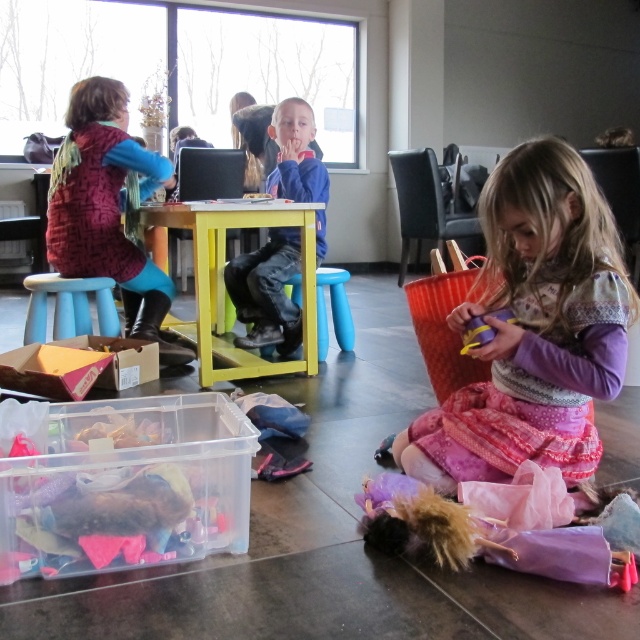
Does pink fabric dress at lower right lie behind blue fleece jacket at center?

No.

Is pink fabric dress at lower right taller than blue fleece jacket at center?

In fact, pink fabric dress at lower right may be shorter than blue fleece jacket at center.

Find the location of `pink fabric dress at lower right`. pink fabric dress at lower right is located at coordinates (534, 330).

Which is below, yellow painted wood table at center or blue fleece jacket at center?

yellow painted wood table at center is below.

Does yellow painted wood table at center have a lesser width compared to blue fleece jacket at center?

No.

Between point (314, 332) and point (288, 332), which one is positioned in front?

Positioned in front is point (314, 332).

Where is `yellow painted wood table at center`? This screenshot has height=640, width=640. yellow painted wood table at center is located at coordinates (224, 284).

Does pink fabric dress at lower right appear over velvety maroon sweater at left?

Incorrect, pink fabric dress at lower right is not positioned above velvety maroon sweater at left.

This screenshot has width=640, height=640. Find the location of `pink fabric dress at lower right`. pink fabric dress at lower right is located at coordinates (534, 330).

At what (x,y) coordinates should I click in order to perform the action: click on pink fabric dress at lower right. Please return your answer as a coordinate pair (x, y). The image size is (640, 640). Looking at the image, I should click on (534, 330).